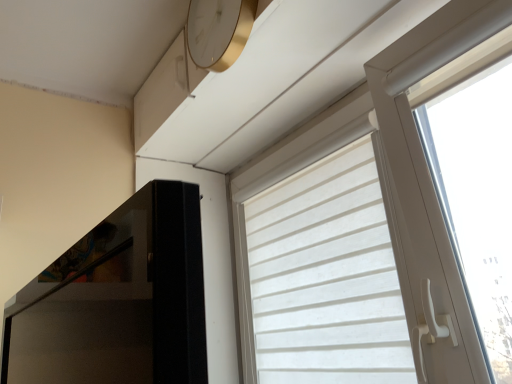
Question: From a real-world perspective, is white matte window at upper right physically below gold metallic clock at upper center?

Choices:
 (A) yes
 (B) no

Answer: (A)

Question: Could you tell me if white matte window at upper right is facing gold metallic clock at upper center?

Choices:
 (A) yes
 (B) no

Answer: (B)

Question: Can we say white matte window at upper right lies outside gold metallic clock at upper center?

Choices:
 (A) no
 (B) yes

Answer: (B)

Question: Is white matte window at upper right to the right of gold metallic clock at upper center from the viewer's perspective?

Choices:
 (A) no
 (B) yes

Answer: (B)

Question: Is white matte window at upper right oriented away from gold metallic clock at upper center?

Choices:
 (A) yes
 (B) no

Answer: (B)

Question: Does white matte window at upper right have a greater height compared to gold metallic clock at upper center?

Choices:
 (A) no
 (B) yes

Answer: (B)

Question: Would you say white matte window at upper right contains white fabric curtain at upper right?

Choices:
 (A) yes
 (B) no

Answer: (A)

Question: Considering the relative sizes of white matte window at upper right and white fabric curtain at upper right in the image provided, is white matte window at upper right taller than white fabric curtain at upper right?

Choices:
 (A) no
 (B) yes

Answer: (B)

Question: Can you confirm if white matte window at upper right is shorter than white fabric curtain at upper right?

Choices:
 (A) no
 (B) yes

Answer: (A)

Question: From a real-world perspective, is white matte window at upper right on top of white fabric curtain at upper right?

Choices:
 (A) yes
 (B) no

Answer: (A)

Question: Is white matte window at upper right thinner than white fabric curtain at upper right?

Choices:
 (A) yes
 (B) no

Answer: (B)

Question: Is the position of white matte window at upper right more distant than that of white fabric curtain at upper right?

Choices:
 (A) no
 (B) yes

Answer: (A)

Question: Would you say white fabric curtain at upper right contains white matte window at upper right?

Choices:
 (A) yes
 (B) no

Answer: (B)